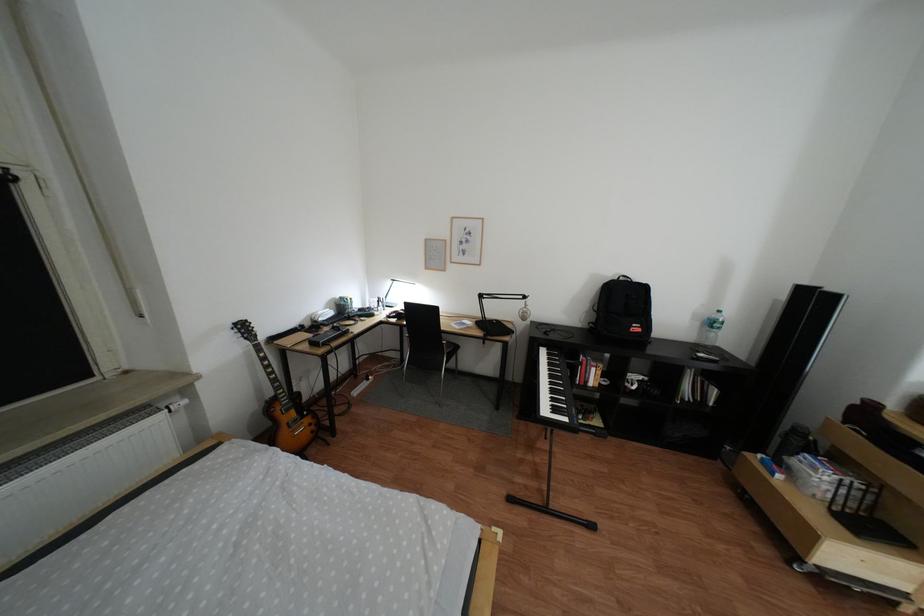
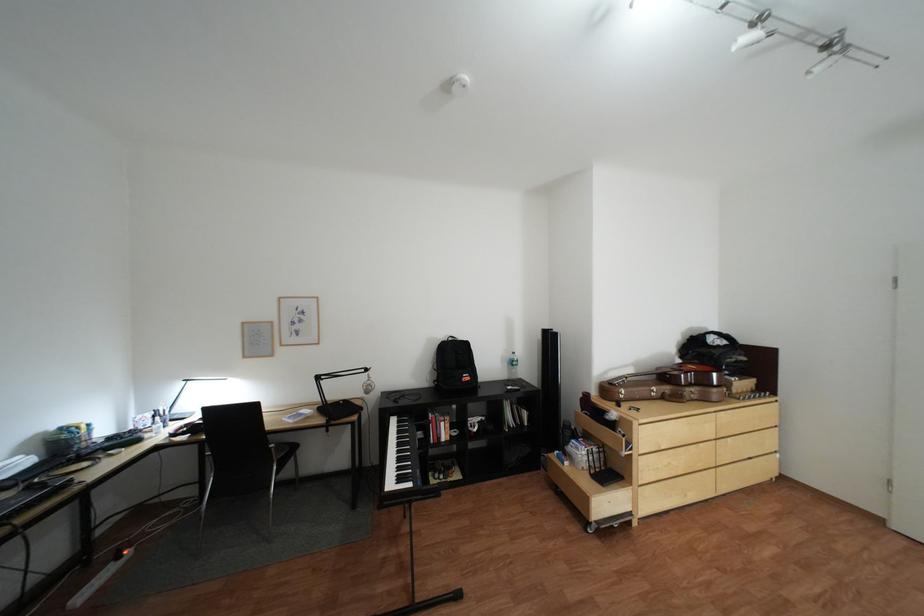
Question: The camera is either moving clockwise (left) or counter-clockwise (right) around the object. The first image is from the beginning of the video and the second image is from the end. Is the camera moving left or right when shooting the video?

Choices:
 (A) Left
 (B) Right

Answer: (A)